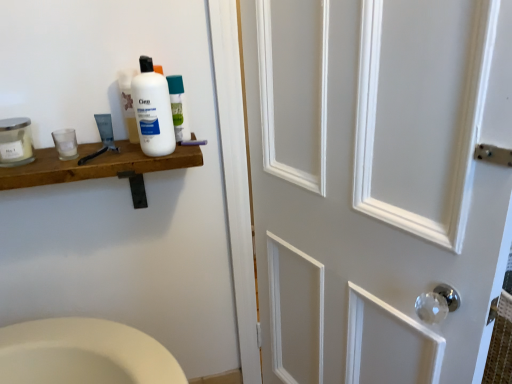
Question: Is white painted wood door at right at the left side of clear glass jar at left, which is the first mouthwash from left to right?

Choices:
 (A) yes
 (B) no

Answer: (B)

Question: Can clear glass jar at left, which is the first mouthwash from left to right, be found inside white painted wood door at right?

Choices:
 (A) no
 (B) yes

Answer: (A)

Question: Can you confirm if white painted wood door at right is thinner than clear glass jar at left, which is the first mouthwash from left to right?

Choices:
 (A) yes
 (B) no

Answer: (B)

Question: Can you confirm if white painted wood door at right is positioned to the right of clear glass jar at left, the third mouthwash when ordered from right to left?

Choices:
 (A) yes
 (B) no

Answer: (A)

Question: Is white painted wood door at right positioned before clear glass jar at left, which is the first mouthwash from left to right?

Choices:
 (A) yes
 (B) no

Answer: (A)

Question: Is white glossy mouthwash at upper center, which is the first mouthwash in right-to-left order, in front of or behind white painted wood door at right in the image?

Choices:
 (A) behind
 (B) front

Answer: (A)

Question: From a real-world perspective, is white glossy mouthwash at upper center, which appears as the third mouthwash when viewed from the left, positioned above or below white painted wood door at right?

Choices:
 (A) above
 (B) below

Answer: (A)

Question: Choose the correct answer: Is white glossy mouthwash at upper center, which appears as the third mouthwash when viewed from the left, inside white painted wood door at right or outside it?

Choices:
 (A) inside
 (B) outside

Answer: (B)

Question: From the image's perspective, is white glossy mouthwash at upper center, which is the first mouthwash in right-to-left order, positioned above or below white painted wood door at right?

Choices:
 (A) below
 (B) above

Answer: (B)

Question: Based on their positions, is white plastic bottle at upper left located to the left or right of white glossy mouthwash at upper center, which is the first mouthwash in right-to-left order?

Choices:
 (A) right
 (B) left

Answer: (B)

Question: In terms of width, does white plastic bottle at upper left look wider or thinner when compared to white glossy mouthwash at upper center, which appears as the third mouthwash when viewed from the left?

Choices:
 (A) wide
 (B) thin

Answer: (A)

Question: Choose the correct answer: Is white plastic bottle at upper left inside white glossy mouthwash at upper center, which appears as the third mouthwash when viewed from the left, or outside it?

Choices:
 (A) inside
 (B) outside

Answer: (B)

Question: Relative to white glossy mouthwash at upper center, which appears as the third mouthwash when viewed from the left, is white plastic bottle at upper left in front or behind?

Choices:
 (A) front
 (B) behind

Answer: (A)

Question: Is white plastic bottle at upper left bigger or smaller than clear glass jar at left, the third mouthwash when ordered from right to left?

Choices:
 (A) small
 (B) big

Answer: (B)

Question: Is point (138, 115) closer or farther from the camera than point (30, 139)?

Choices:
 (A) closer
 (B) farther

Answer: (A)